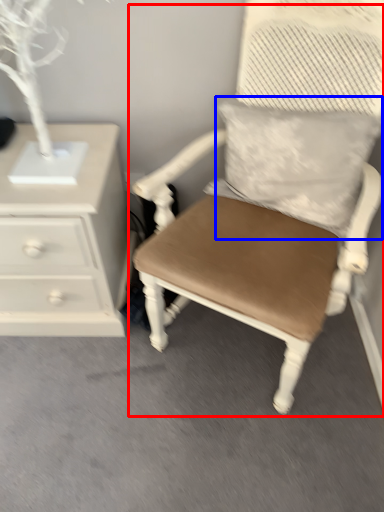
Question: Among these objects, which one is farthest to the camera, chair (highlighted by a red box) or pillow (highlighted by a blue box)?

Choices:
 (A) chair
 (B) pillow

Answer: (B)